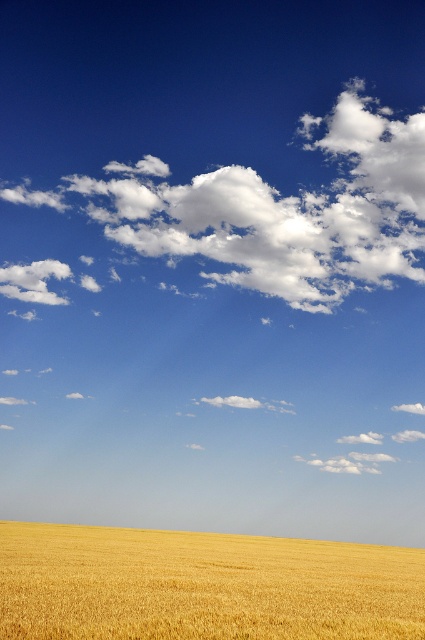
You are an agricultural drone flying over a golden wheat field. You need to take a photo of the white fluffy cloud at upper center. What are the exact coordinates where you should point your camera?

The white fluffy cloud at upper center is located at coordinates 0.330 on the x axis and 0.652 on the y axis, so you should point your camera to those exact coordinates to capture it.

You are a farmer planning to install a weather monitoring drone that requires a clear view of the sky. You have two options for placement based on the scene you see. The first option is near the golden matte wheat field at bottom, and the second is under the white fluffy cloud at upper center. Which location would provide a better vantage point for sky observation?

The white fluffy cloud at upper center is much taller than the golden matte wheat field at bottom, so placing the drone under the white fluffy cloud at upper center would offer a better vantage point for sky observation as it is higher and less obstructed by the wheat field.

Based on the scene description, which object, the white fluffy cloud at upper center or the golden matte wheat field at bottom, occupies a larger area in the image?

The golden matte wheat field at bottom occupies a larger area in the image compared to the white fluffy cloud at upper center, as the cloud is described as smaller in size.